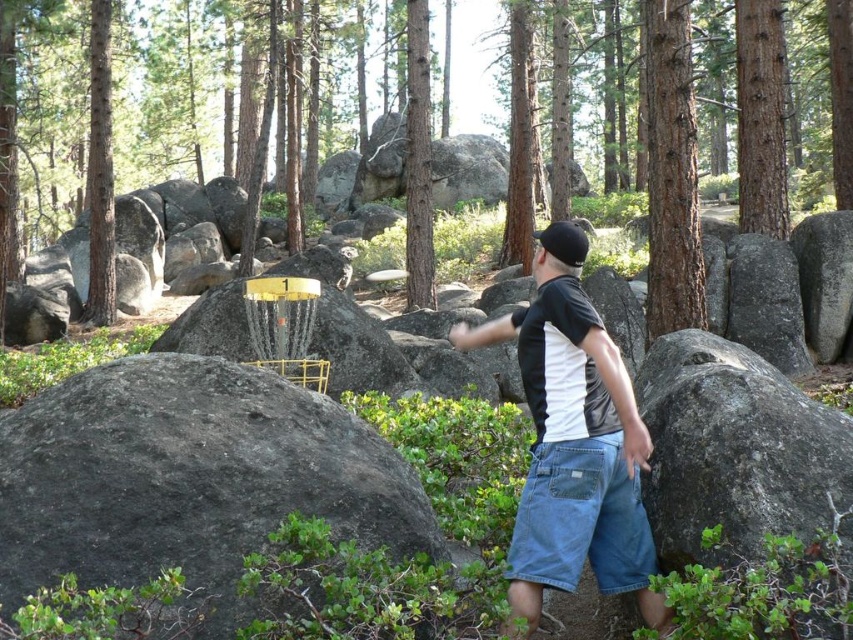
Who is lower down, smooth brown tree trunk at left or black matte baseball hat at center?

Positioned lower is black matte baseball hat at center.

Does smooth brown tree trunk at left appear on the left side of black matte baseball hat at center?

Correct, you'll find smooth brown tree trunk at left to the left of black matte baseball hat at center.

Describe the element at coordinates (99, 173) in the screenshot. The width and height of the screenshot is (853, 640). I see `smooth brown tree trunk at left` at that location.

Find the location of `smooth brown tree trunk at left`. smooth brown tree trunk at left is located at coordinates (99, 173).

Based on the photo, can you confirm if gray rock at center is positioned below brown rough bark tree at right?

Yes, gray rock at center is below brown rough bark tree at right.

Describe the element at coordinates (189, 480) in the screenshot. The image size is (853, 640). I see `gray rock at center` at that location.

At what (x,y) coordinates should I click in order to perform the action: click on gray rock at center. Please return your answer as a coordinate pair (x, y). This screenshot has height=640, width=853. Looking at the image, I should click on [x=189, y=480].

Can you confirm if green textured tree at center is positioned below brown rough bark tree at right?

Incorrect, green textured tree at center is not positioned below brown rough bark tree at right.

Is point (822, 61) behind point (650, 284)?

Yes, point (822, 61) is farther from viewer.

Where is `green textured tree at center`? Image resolution: width=853 pixels, height=640 pixels. green textured tree at center is located at coordinates (51, 104).